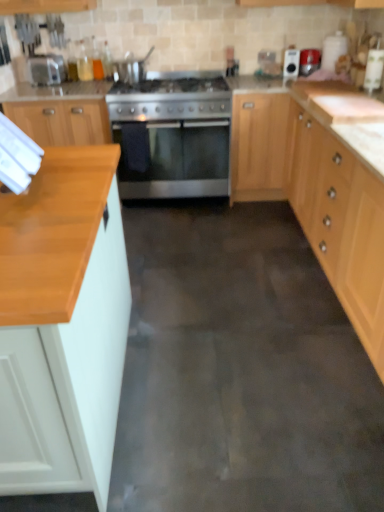
How much space does satin silver pot at upper center, placed as the first appliance when sorted from left to right, occupy horizontally?

It is 8.79 inches.

This screenshot has width=384, height=512. What do you see at coordinates (179, 161) in the screenshot?
I see `stainless steel oven at center` at bounding box center [179, 161].

What do you see at coordinates (291, 63) in the screenshot?
I see `metallic silver toaster at upper right, placed as the second appliance when sorted from right to left` at bounding box center [291, 63].

The width and height of the screenshot is (384, 512). I want to click on wooden cabinet at center, which is counted as the second cabinetry, starting from the bottom, so click(258, 146).

Locate an element on the screen. The height and width of the screenshot is (512, 384). satin silver pot at upper center, which is counted as the 3th appliance, starting from the right is located at coordinates (130, 68).

Which object is closer to the camera, wooden countertop at left, which is the 2th cabinetry in back-to-front order, or satin silver toaster at upper left?

wooden countertop at left, which is the 2th cabinetry in back-to-front order.

Can you confirm if wooden countertop at left, placed as the 1th cabinetry when sorted from bottom to top, is bigger than satin silver toaster at upper left?

Yes, wooden countertop at left, placed as the 1th cabinetry when sorted from bottom to top, is bigger than satin silver toaster at upper left.

What are the coordinates of `kitchen appliance that is above the wooden countertop at left, placed as the 1th cabinetry when sorted from bottom to top (from a real-world perspective)` in the screenshot? It's located at (46, 69).

Can you tell me how much wooden countertop at left, the second cabinetry in the top-to-bottom sequence, and satin silver toaster at upper left differ in facing direction?

178 degrees separate the facing orientations of wooden countertop at left, the second cabinetry in the top-to-bottom sequence, and satin silver toaster at upper left.

What's the angular difference between satin silver toaster at upper left and stainless steel oven at center's facing directions?

satin silver toaster at upper left and stainless steel oven at center are facing 2.23 degrees away from each other.

Which of these two, satin silver toaster at upper left or stainless steel oven at center, is smaller?

satin silver toaster at upper left is smaller.

Does point (58, 68) come in front of point (143, 186)?

Yes.

Which object is closer to the camera taking this photo, satin silver toaster at upper left or stainless steel oven at center?

stainless steel oven at center is closer to the camera.

Considering the points (130, 93) and (33, 64), which point is in front, point (130, 93) or point (33, 64)?

The point (130, 93) is closer.

From the picture: Is stainless steel gas stove at center completely or partially outside of satin silver toaster at upper left?

stainless steel gas stove at center lies outside satin silver toaster at upper left's area.

What's the angular difference between stainless steel gas stove at center and satin silver toaster at upper left's facing directions?

The angle between the facing direction of stainless steel gas stove at center and the facing direction of satin silver toaster at upper left is 2.63 degrees.

Does stainless steel gas stove at center have a greater height compared to satin silver toaster at upper left?

Indeed, stainless steel gas stove at center has a greater height compared to satin silver toaster at upper left.

Considering the relative sizes of metallic silver toaster at upper right, the 2th appliance when ordered from left to right, and stainless steel gas stove at center in the image provided, is metallic silver toaster at upper right, the 2th appliance when ordered from left to right, thinner than stainless steel gas stove at center?

Yes, metallic silver toaster at upper right, the 2th appliance when ordered from left to right, is thinner than stainless steel gas stove at center.

Is metallic silver toaster at upper right, placed as the second appliance when sorted from right to left, turned away from stainless steel gas stove at center?

No, stainless steel gas stove at center is not at the back of metallic silver toaster at upper right, placed as the second appliance when sorted from right to left.

From a real-world perspective, who is located higher, metallic silver toaster at upper right, placed as the second appliance when sorted from right to left, or stainless steel gas stove at center?

metallic silver toaster at upper right, placed as the second appliance when sorted from right to left.

Does metallic silver toaster at upper right, placed as the second appliance when sorted from right to left, appear on the right side of stainless steel gas stove at center?

Indeed, metallic silver toaster at upper right, placed as the second appliance when sorted from right to left, is positioned on the right side of stainless steel gas stove at center.

Who is shorter, satin silver pot at upper center, which is counted as the 3th appliance, starting from the right, or wooden cabinet at center, which is counted as the second cabinetry, starting from the bottom?

Standing shorter between the two is satin silver pot at upper center, which is counted as the 3th appliance, starting from the right.

Is satin silver pot at upper center, which is counted as the 3th appliance, starting from the right, oriented away from wooden cabinet at center, which is counted as the second cabinetry, starting from the bottom?

No, wooden cabinet at center, which is counted as the second cabinetry, starting from the bottom, is not at the back of satin silver pot at upper center, which is counted as the 3th appliance, starting from the right.

Considering the positions of points (129, 59) and (247, 127), is point (129, 59) farther from camera compared to point (247, 127)?

Yes, point (129, 59) is behind point (247, 127).

Between wooden cabinet at center, which is counted as the 1th cabinetry, starting from the back, and stainless steel gas stove at center, which one has less height?

Standing shorter between the two is stainless steel gas stove at center.

Can you confirm if wooden cabinet at center, which is counted as the 1th cabinetry, starting from the back, is smaller than stainless steel gas stove at center?

No, wooden cabinet at center, which is counted as the 1th cabinetry, starting from the back, is not smaller than stainless steel gas stove at center.

Can you confirm if wooden cabinet at center, which is counted as the 1th cabinetry, starting from the back, is wider than stainless steel gas stove at center?

No, wooden cabinet at center, which is counted as the 1th cabinetry, starting from the back, is not wider than stainless steel gas stove at center.

Can you tell me how much wooden cabinet at center, which appears as the 1th cabinetry when viewed from the top, and stainless steel gas stove at center differ in facing direction?

wooden cabinet at center, which appears as the 1th cabinetry when viewed from the top, and stainless steel gas stove at center are facing 0.714 degrees away from each other.

Which object is further away from the camera taking this photo, metallic silver toaster at upper right, the 2th appliance when ordered from left to right, or satin silver toaster at upper left?

metallic silver toaster at upper right, the 2th appliance when ordered from left to right, is further from the camera.

Is metallic silver toaster at upper right, the 2th appliance when ordered from left to right, facing towards satin silver toaster at upper left?

No, metallic silver toaster at upper right, the 2th appliance when ordered from left to right, is not oriented towards satin silver toaster at upper left.

Considering the sizes of objects metallic silver toaster at upper right, placed as the second appliance when sorted from right to left, and satin silver toaster at upper left in the image provided, who is thinner, metallic silver toaster at upper right, placed as the second appliance when sorted from right to left, or satin silver toaster at upper left?

metallic silver toaster at upper right, placed as the second appliance when sorted from right to left, is thinner.

Is metallic silver toaster at upper right, placed as the second appliance when sorted from right to left, surrounding satin silver toaster at upper left?

No.

Find the location of a particular element. Image resolution: width=384 pixels, height=512 pixels. the 1st cabinetry positioned below the satin silver toaster at upper left (from a real-world perspective) is located at coordinates (64, 323).

Where is `oven on the right side of satin silver toaster at upper left`? The height and width of the screenshot is (512, 384). oven on the right side of satin silver toaster at upper left is located at coordinates (179, 161).

Consider the image. Based on their spatial positions, is wooden countertop at left, the second cabinetry in the top-to-bottom sequence, or satin silver toaster at upper left further from metallic red toaster at upper right, the first appliance from the right?

wooden countertop at left, the second cabinetry in the top-to-bottom sequence.

Estimate the real-world distances between objects in this image. Which object is further from wooden countertop at left, placed as the 1th cabinetry when sorted from bottom to top, stainless steel oven at center or stainless steel gas stove at center?

The object further to wooden countertop at left, placed as the 1th cabinetry when sorted from bottom to top, is stainless steel gas stove at center.

When comparing their distances from satin silver pot at upper center, which is counted as the 3th appliance, starting from the right, does wooden countertop at left, which is the 2th cabinetry in back-to-front order, or metallic silver toaster at upper right, placed as the second appliance when sorted from right to left, seem further?

The object further to satin silver pot at upper center, which is counted as the 3th appliance, starting from the right, is wooden countertop at left, which is the 2th cabinetry in back-to-front order.

Which object lies further to the anchor point metallic silver toaster at upper right, the 2th appliance when ordered from left to right, satin silver pot at upper center, placed as the first appliance when sorted from left to right, or stainless steel gas stove at center?

Among the two, satin silver pot at upper center, placed as the first appliance when sorted from left to right, is located further to metallic silver toaster at upper right, the 2th appliance when ordered from left to right.

From the image, which object appears to be nearer to wooden cabinet at center, which ranks as the 2th cabinetry in left-to-right order, satin silver toaster at upper left or stainless steel oven at center?

Among the two, stainless steel oven at center is located nearer to wooden cabinet at center, which ranks as the 2th cabinetry in left-to-right order.

Which object lies nearer to the anchor point satin silver pot at upper center, which is counted as the 3th appliance, starting from the right, stainless steel oven at center or stainless steel gas stove at center?

stainless steel gas stove at center is positioned closer to the anchor satin silver pot at upper center, which is counted as the 3th appliance, starting from the right.

Considering their positions, is wooden cabinet at center, which is counted as the second cabinetry, starting from the bottom, positioned closer to satin silver toaster at upper left than stainless steel oven at center?

stainless steel oven at center.

Looking at the image, which one is located further to wooden countertop at left, which is the 1th cabinetry from front to back, satin silver toaster at upper left or wooden cabinet at center, which is counted as the second cabinetry, starting from the bottom?

satin silver toaster at upper left is further to wooden countertop at left, which is the 1th cabinetry from front to back.

Where is `gas stove between satin silver toaster at upper left and metallic red toaster at upper right, positioned as the 3th appliance in left-to-right order, in the horizontal direction`? gas stove between satin silver toaster at upper left and metallic red toaster at upper right, positioned as the 3th appliance in left-to-right order, in the horizontal direction is located at coordinates (169, 99).

This screenshot has height=512, width=384. Identify the location of oven between satin silver toaster at upper left and metallic red toaster at upper right, the first appliance from the right. (179, 161).

Locate an element on the screen. The image size is (384, 512). oven between satin silver toaster at upper left and metallic silver toaster at upper right, the 2th appliance when ordered from left to right, in the horizontal direction is located at coordinates (179, 161).

Where is `oven between wooden countertop at left, which is counted as the second cabinetry, starting from the right, and metallic silver toaster at upper right, placed as the second appliance when sorted from right to left, from front to back`? oven between wooden countertop at left, which is counted as the second cabinetry, starting from the right, and metallic silver toaster at upper right, placed as the second appliance when sorted from right to left, from front to back is located at coordinates (179, 161).